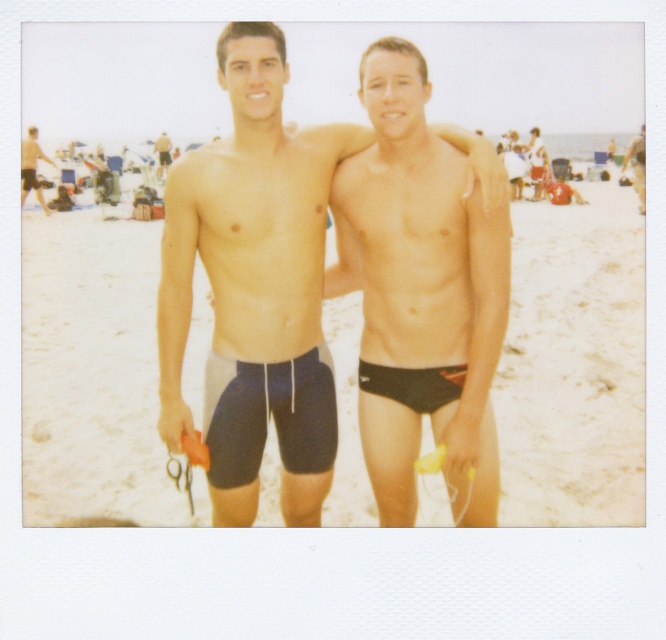
You are taking a photo of the beach scene and want to focus on both point (513, 432) and point (204, 164). Which point is closer to the camera?

Point (204, 164) is closer to the camera because the description states that point (513, 432) is further away.

You are standing on the beach and want to place a small seashell exactly between the beige sand at center and the black matte shorts at center. Based on their positions, which object should the seashell be closer to?

The beige sand at center is to the left of black matte shorts at center, so the seashell should be placed closer to the black matte shorts at center since it is positioned to the right of the beige sand at center.